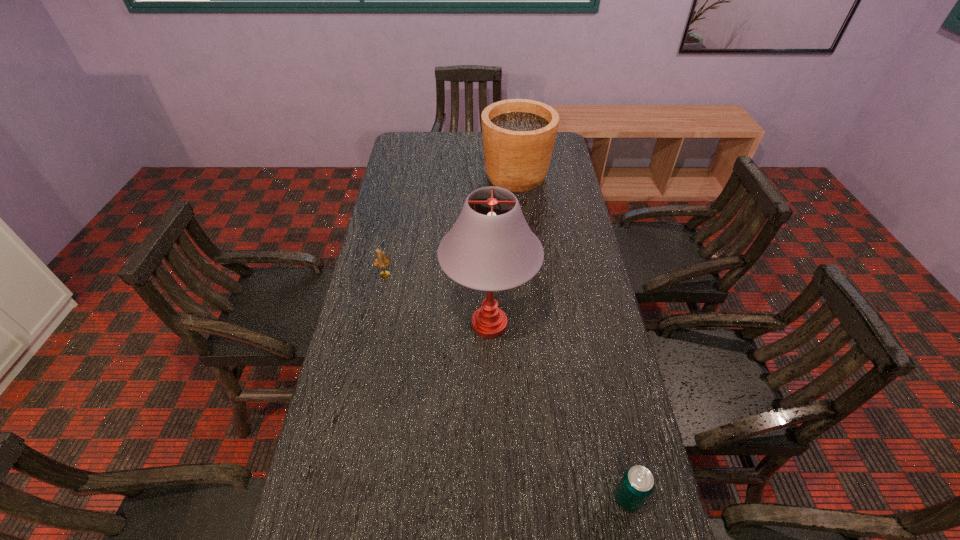
The height and width of the screenshot is (540, 960). What are the coordinates of `vacant area in the image that satisfies the following two spatial constraints: 1. on the back side of the second farthest object; 2. on the left side of the second tallest object` in the screenshot? It's located at (406, 176).

Identify the location of free space in the image that satisfies the following two spatial constraints: 1. on the back side of the farthest object; 2. on the right side of the leftmost object. The width and height of the screenshot is (960, 540). (406, 176).